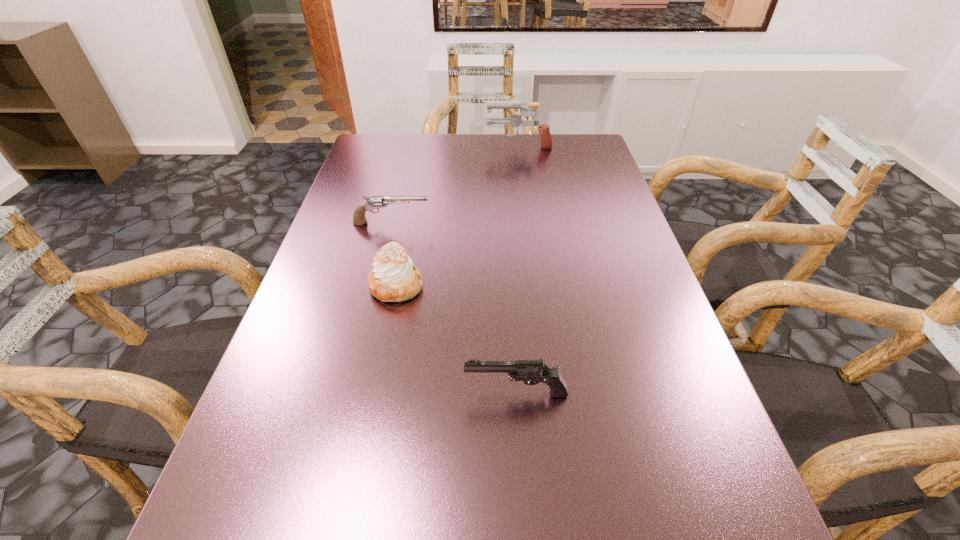
I want to click on vacant space that is in between the shortest object and the farthest gun, so click(455, 184).

Identify the location of unoccupied area between the nearest object and the second nearest gun. (454, 308).

This screenshot has height=540, width=960. Find the location of `free area in between the tallest object and the nearest object`. free area in between the tallest object and the nearest object is located at coordinates (517, 269).

Locate an element on the screen. The image size is (960, 540). object identified as the second closest to the pastry is located at coordinates (531, 372).

Point out which object is positioned as the nearest to the third farthest object. Please provide its 2D coordinates. Your answer should be formatted as a tuple, i.e. [(x, y)], where the tuple contains the x and y coordinates of a point satisfying the conditions above.

[(374, 202)]

Identify the location of gun that is the closest to the nearest object. (374, 202).

Choose which gun is the second nearest neighbor to the nearest object. Please provide its 2D coordinates. Your answer should be formatted as a tuple, i.e. [(x, y)], where the tuple contains the x and y coordinates of a point satisfying the conditions above.

[(515, 120)]

At what (x,y) coordinates should I click in order to perform the action: click on free space that satisfies the following two spatial constraints: 1. aiming along the barrel of the second nearest gun; 2. on the right side of the pastry. Please return your answer as a coordinate pair (x, y). Looking at the image, I should click on pyautogui.click(x=375, y=286).

The height and width of the screenshot is (540, 960). What are the coordinates of `free space that satisfies the following two spatial constraints: 1. aiming along the barrel of the second nearest gun; 2. on the right side of the second nearest object` in the screenshot? It's located at (375, 286).

The width and height of the screenshot is (960, 540). I want to click on free location that satisfies the following two spatial constraints: 1. at the barrel end of the tallest gun; 2. on the front side of the third farthest object, so click(539, 286).